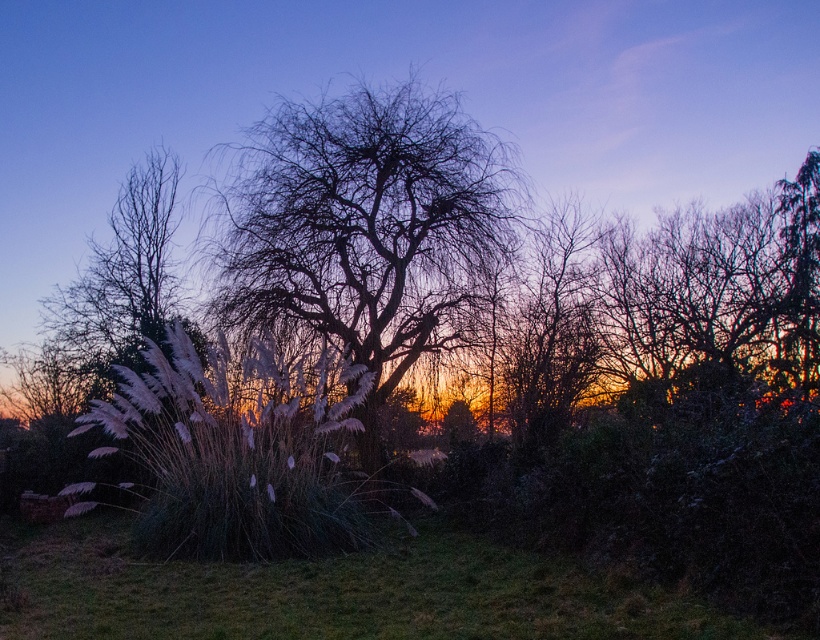
Question: Which point appears farthest from the camera in this image?

Choices:
 (A) (415, 88)
 (B) (117, 278)
 (C) (139, 627)

Answer: (B)

Question: Is green grass at lower center further to the viewer compared to white fluffy grass at left?

Choices:
 (A) yes
 (B) no

Answer: (B)

Question: Is bare branches at center bigger than white fluffy grass at left?

Choices:
 (A) no
 (B) yes

Answer: (A)

Question: Among these points, which one is nearest to the camera?

Choices:
 (A) (329, 120)
 (B) (167, 189)
 (C) (486, 541)

Answer: (C)

Question: Which object appears farthest from the camera in this image?

Choices:
 (A) white fluffy grass at left
 (B) bare branches at center
 (C) green grass at lower center

Answer: (A)

Question: Is green grass at lower center to the left of white fluffy grass at left from the viewer's perspective?

Choices:
 (A) no
 (B) yes

Answer: (A)